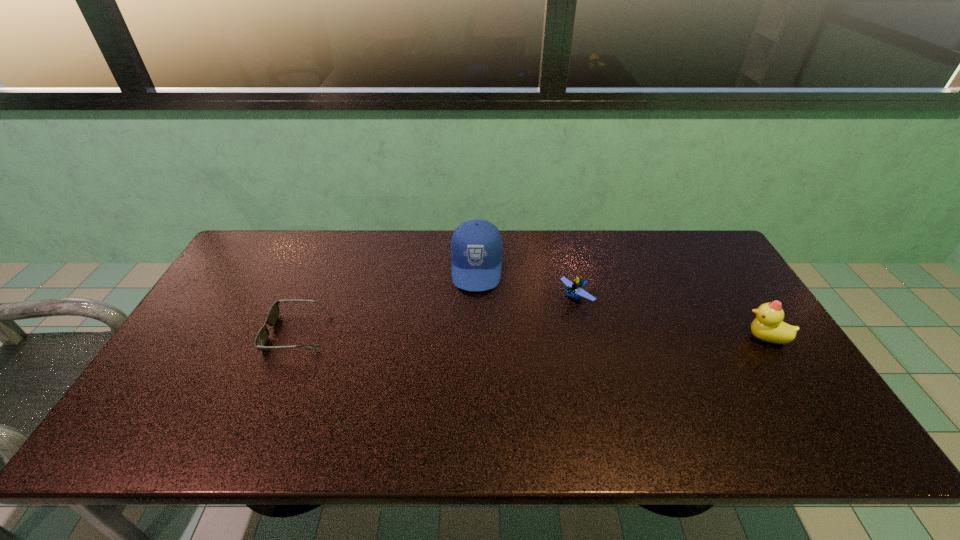
Where is `free spot between the shortest object and the second object from right to left`? The width and height of the screenshot is (960, 540). free spot between the shortest object and the second object from right to left is located at coordinates point(437,315).

The width and height of the screenshot is (960, 540). Identify the location of free space between the Lego and the leftmost object. (437, 315).

Locate an element on the screen. The image size is (960, 540). free space between the sunglasses and the third tallest object is located at coordinates (437, 315).

At what (x,y) coordinates should I click in order to perform the action: click on vacant point located between the cap and the duckling. Please return your answer as a coordinate pair (x, y). Looking at the image, I should click on (621, 303).

Find the location of a particular element. The width and height of the screenshot is (960, 540). unoccupied area between the rightmost object and the shortest object is located at coordinates (532, 335).

At what (x,y) coordinates should I click in order to perform the action: click on vacant area that lies between the leftmost object and the Lego. Please return your answer as a coordinate pair (x, y). The image size is (960, 540). Looking at the image, I should click on (437, 315).

Point out which object is positioned as the third nearest to the second object from left to right. Please provide its 2D coordinates. Your answer should be formatted as a tuple, i.e. [(x, y)], where the tuple contains the x and y coordinates of a point satisfying the conditions above.

[(768, 325)]

I want to click on the closest object to the Lego, so click(x=476, y=247).

Identify the location of vacant space that satisfies the following two spatial constraints: 1. on the front side of the duckling; 2. on the front-facing side of the cap. (476, 338).

Find the location of a particular element. blank area in the image that satisfies the following two spatial constraints: 1. on the front side of the cap; 2. on the front-facing side of the duckling is located at coordinates tap(476, 338).